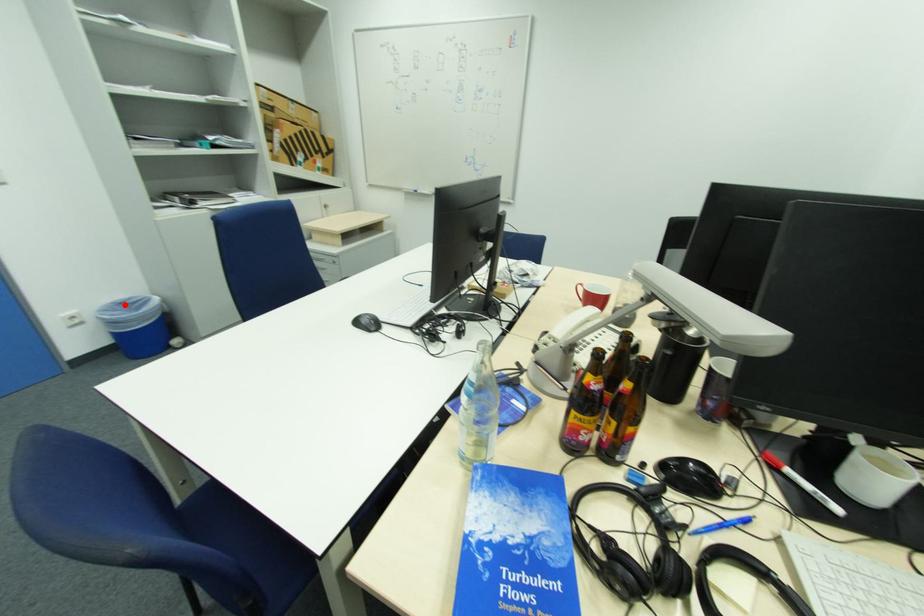
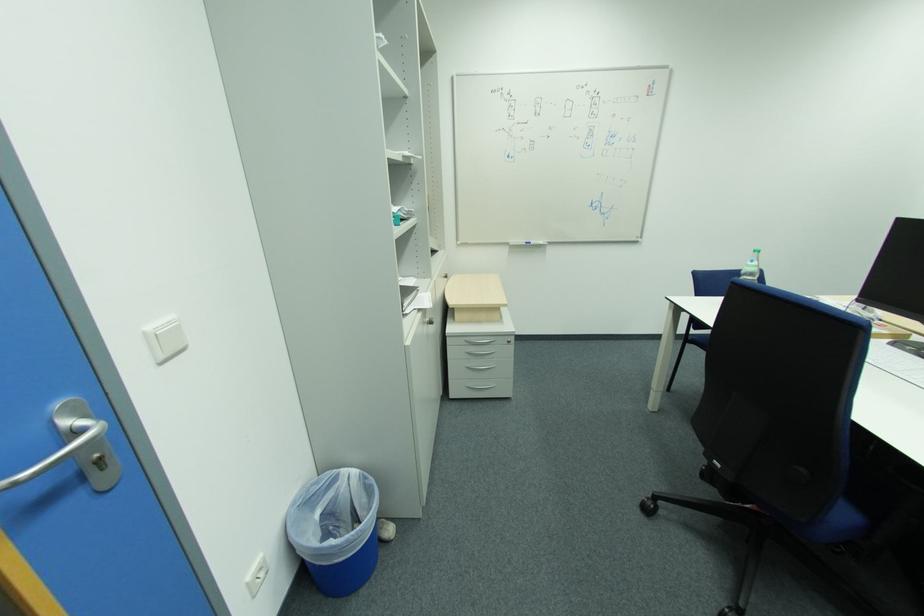
The point at the highlighted location is marked in the first image. Where is the corresponding point in the second image?

(304, 507)